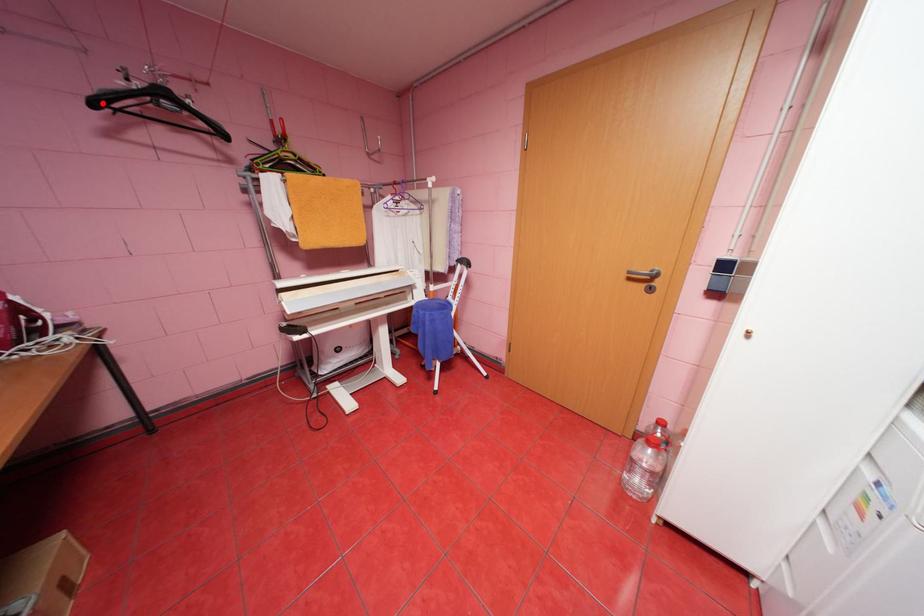
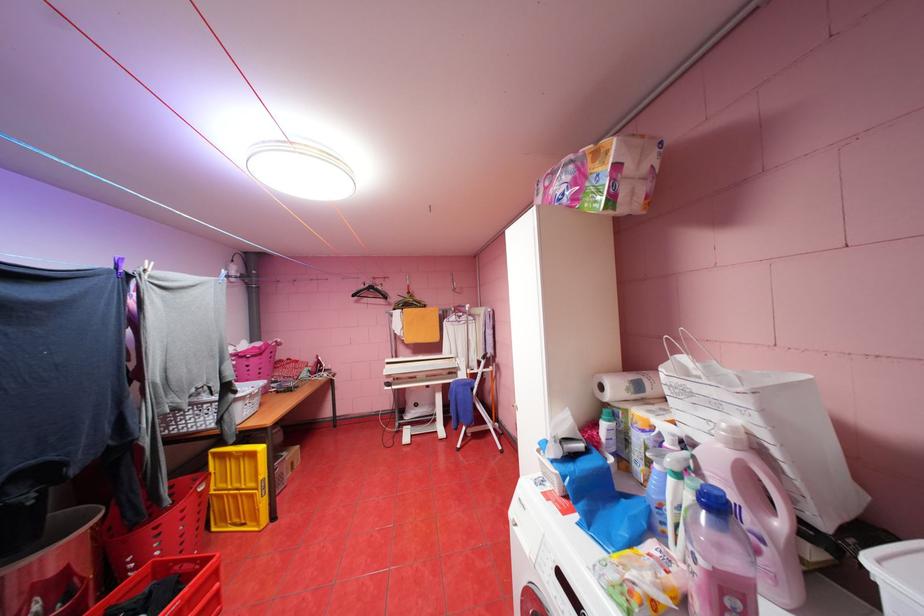
Locate, in the second image, the point that corresponds to the highlighted location in the first image.

(361, 294)